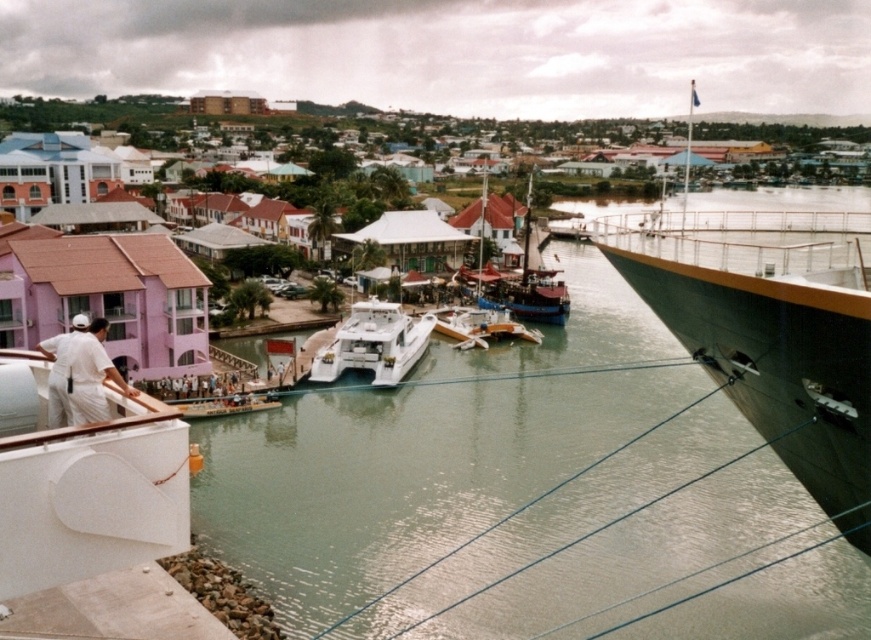
Question: Which of these objects is positioned farthest from the wooden sailboat at center?

Choices:
 (A) white uniform at left
 (B) white matte uniform at lower left
 (C) dark gray metallic cruise ship at right
 (D) wooden cabin cruiser at center

Answer: (A)

Question: Considering the real-world distances, which object is farthest from the white matte uniform at lower left?

Choices:
 (A) white glossy catamaran at center
 (B) dark gray metallic cruise ship at right
 (C) white uniform at left
 (D) wooden cabin cruiser at center

Answer: (D)

Question: Where is white glossy catamaran at center located in relation to white matte uniform at lower left in the image?

Choices:
 (A) right
 (B) left

Answer: (A)

Question: Does wooden sailboat at center appear over wooden cabin cruiser at center?

Choices:
 (A) no
 (B) yes

Answer: (B)

Question: Is white glossy catamaran at center to the left of wooden sailboat at center from the viewer's perspective?

Choices:
 (A) no
 (B) yes

Answer: (B)

Question: Which point is closer to the camera taking this photo?

Choices:
 (A) (39, 348)
 (B) (318, 376)
 (C) (707, 426)
 (D) (667, 296)

Answer: (A)